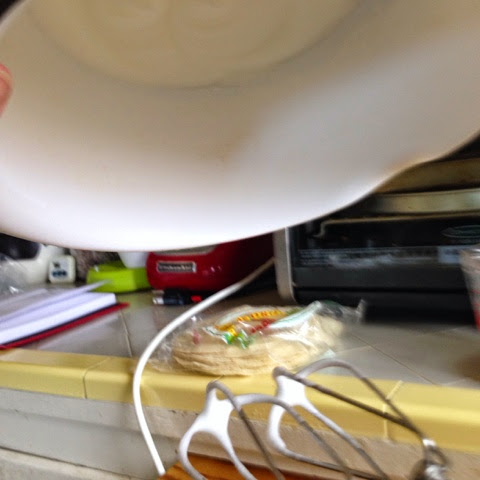
Locate an element on the screen. bowl is located at coordinates (338, 146).